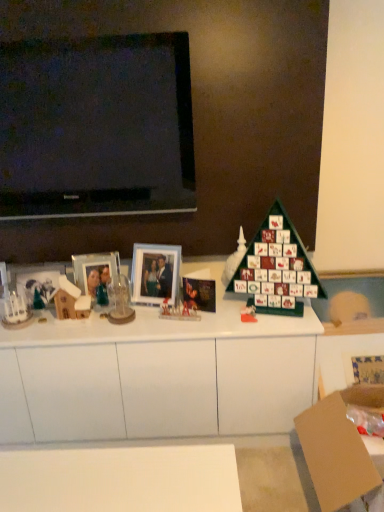
You are a GUI agent. You are given a task and a screenshot of the screen. Output one action in this format:
    pyautogui.click(x=<x>, y=<y>)
    Task: Click on the free space in front of white matte christmas tree at center, acting as the third toy starting from the left
    
    Given the screenshot: What is the action you would take?
    pyautogui.click(x=238, y=313)